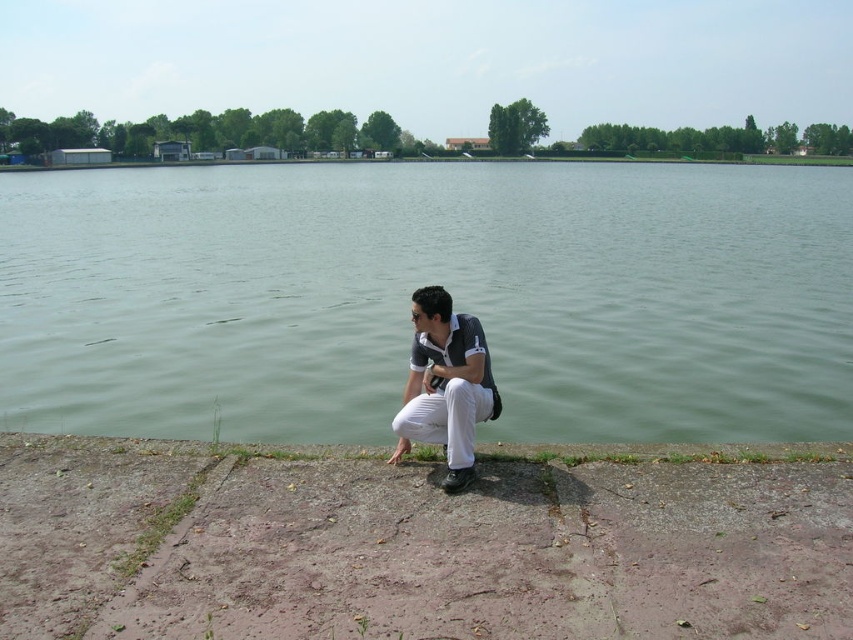
Question: Does green water at lower center have a greater width compared to gray concrete curb at lower center?

Choices:
 (A) no
 (B) yes

Answer: (B)

Question: Is the position of green water at lower center less distant than that of gray concrete curb at lower center?

Choices:
 (A) no
 (B) yes

Answer: (B)

Question: Which point appears farthest from the camera in this image?

Choices:
 (A) (425, 378)
 (B) (170, 445)
 (C) (645, 221)

Answer: (C)

Question: Which point appears closest to the camera in this image?

Choices:
 (A) (427, 417)
 (B) (20, 442)

Answer: (A)

Question: Estimate the real-world distances between objects in this image. Which object is closer to the green water at lower center?

Choices:
 (A) gray concrete curb at lower center
 (B) white cotton pants at lower center

Answer: (B)

Question: Is green water at lower center positioned before gray concrete curb at lower center?

Choices:
 (A) no
 (B) yes

Answer: (B)